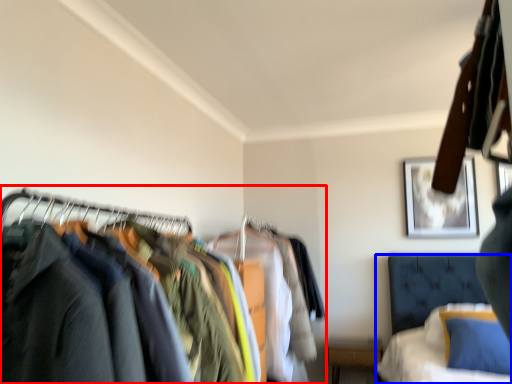
Question: Which object appears farthest to the camera in this image, closet (highlighted by a red box) or bed (highlighted by a blue box)?

Choices:
 (A) closet
 (B) bed

Answer: (B)